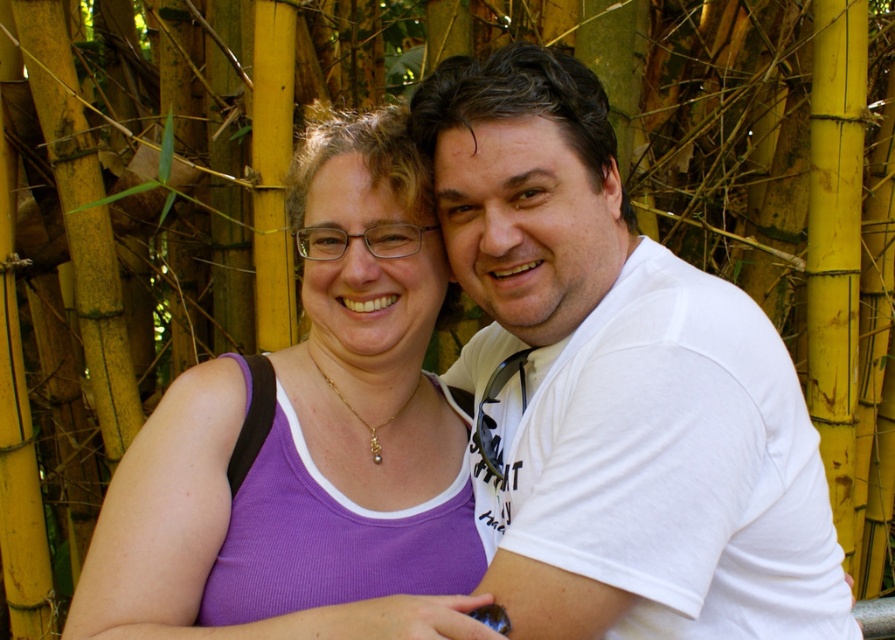
How distant is white cotton shirt at center from purple fabric tank top at center?

white cotton shirt at center is 10.48 inches away from purple fabric tank top at center.

Between point (541, 140) and point (181, 554), which one is positioned behind?

The point (541, 140) is more distant.

Which is behind, point (650, 499) or point (446, 605)?

The point (446, 605) is behind.

The width and height of the screenshot is (895, 640). In order to click on white cotton shirt at center in this screenshot , I will do `click(618, 385)`.